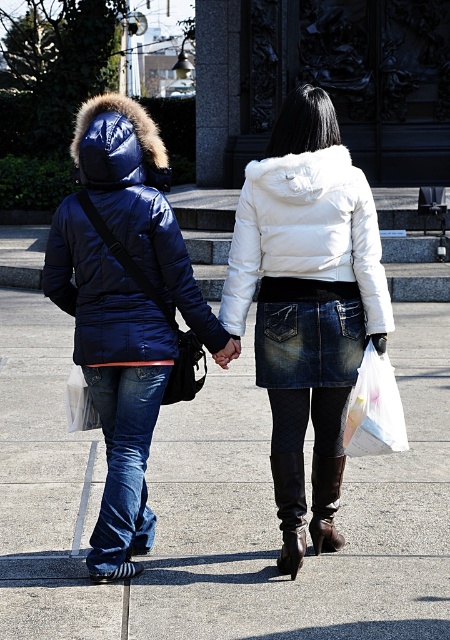
Is smooth concrete pavement at center smaller than denim skirt at center?

No.

Which of these two, smooth concrete pavement at center or denim skirt at center, stands taller?

denim skirt at center is taller.

Where is `smooth concrete pavement at center`? smooth concrete pavement at center is located at coordinates (219, 506).

Between translucent plastic bag at lower right and denim skirt at center, which one has less height?

Standing shorter between the two is denim skirt at center.

Who is positioned more to the right, translucent plastic bag at lower right or denim skirt at center?

Positioned to the right is denim skirt at center.

Where is `translucent plastic bag at lower right`? This screenshot has height=640, width=450. translucent plastic bag at lower right is located at coordinates (374, 410).

Based on the photo, which of these two, white fur-lined jacket at center or denim skirt at center, stands shorter?

denim skirt at center is shorter.

Is white fur-lined jacket at center positioned at the back of denim skirt at center?

No, it is not.

Who is more distant from viewer, (333, 346) or (378, 342)?

The point (378, 342) is more distant.

Where is `white fur-lined jacket at center`? white fur-lined jacket at center is located at coordinates (306, 304).